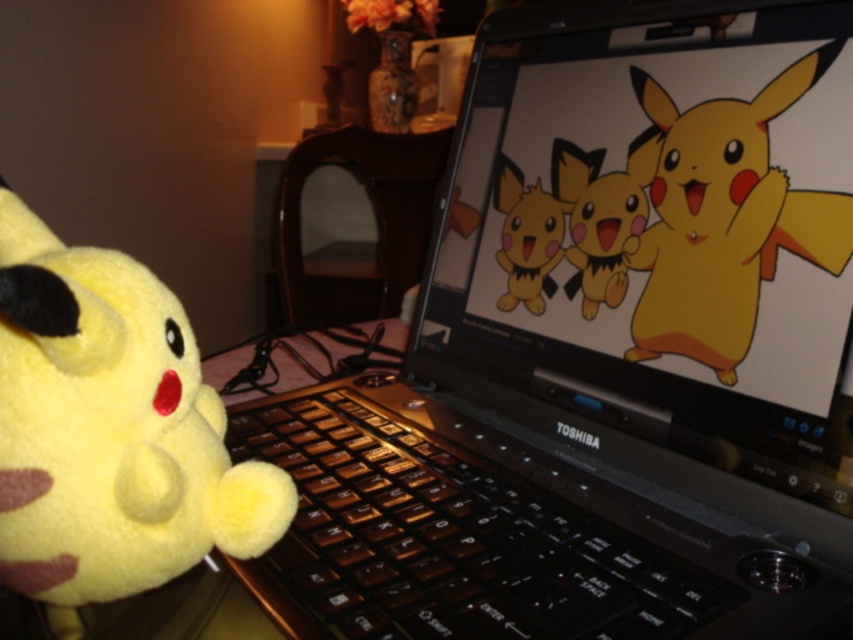
Question: Does brown matte keyboard at center have a lesser width compared to fluffy yellow plush at left?

Choices:
 (A) yes
 (B) no

Answer: (B)

Question: Among these points, which one is nearest to the camera?

Choices:
 (A) (80, 348)
 (B) (376, 442)

Answer: (A)

Question: Estimate the real-world distances between objects in this image. Which object is closer to the brown matte keyboard at center?

Choices:
 (A) fluffy yellow plush at left
 (B) yellow plush toy at center

Answer: (A)

Question: Is brown matte keyboard at center bigger than yellow plush toy at center?

Choices:
 (A) yes
 (B) no

Answer: (A)

Question: Does fluffy yellow plush at left appear over yellow plush toy at center?

Choices:
 (A) yes
 (B) no

Answer: (B)

Question: Which point appears farthest from the camera in this image?

Choices:
 (A) (795, 81)
 (B) (85, 250)
 (C) (440, 636)

Answer: (A)